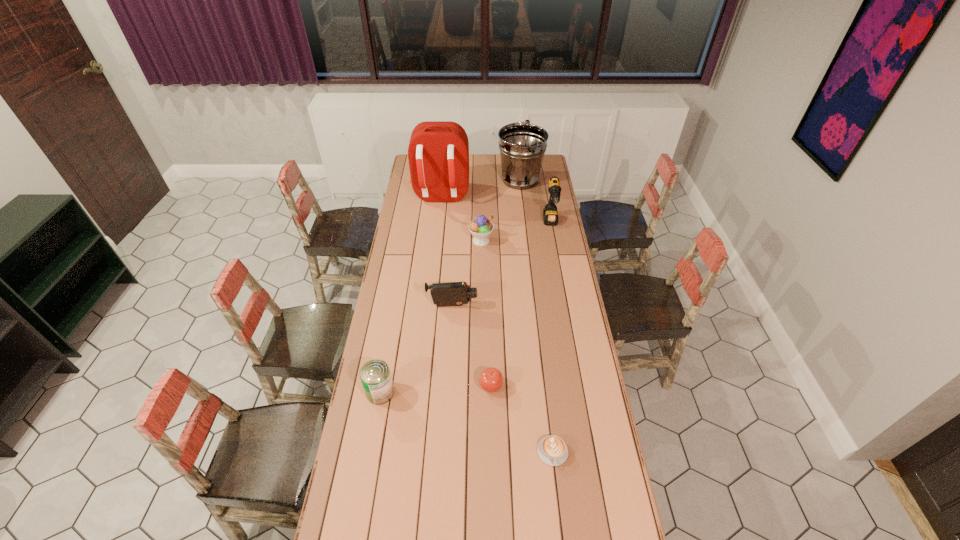
This screenshot has height=540, width=960. I want to click on blank space located 0.280m on the front of the bucket, so click(x=525, y=225).

Locate an element on the screen. This screenshot has height=540, width=960. free space located 0.390m at the tip of the drill is located at coordinates (563, 291).

Where is `vacant space located 0.200m on the right of the icecream`? The image size is (960, 540). vacant space located 0.200m on the right of the icecream is located at coordinates (533, 240).

Find the location of a particular element. vacant space located on the front-facing side of the fifth farthest object is located at coordinates (507, 306).

Image resolution: width=960 pixels, height=540 pixels. I want to click on vacant area situated on the right of the can, so click(x=435, y=392).

Find the location of a particular element. vacant area situated 0.230m on the left of the apple is located at coordinates (418, 386).

You are a GUI agent. You are given a task and a screenshot of the screen. Output one action in this format:
    pyautogui.click(x=<x>, y=<y>)
    Task: Click on the vacant region located 0.130m on the side of the nearest object with the handle
    
    Given the screenshot: What is the action you would take?
    pyautogui.click(x=560, y=511)

At what (x,y) coordinates should I click in order to perform the action: click on object at the far edge. Please return your answer as a coordinate pair (x, y). The height and width of the screenshot is (540, 960). Looking at the image, I should click on (522, 146).

Image resolution: width=960 pixels, height=540 pixels. I want to click on backpack that is at the left edge, so click(x=438, y=153).

The image size is (960, 540). Identify the location of can that is at the left edge. (375, 375).